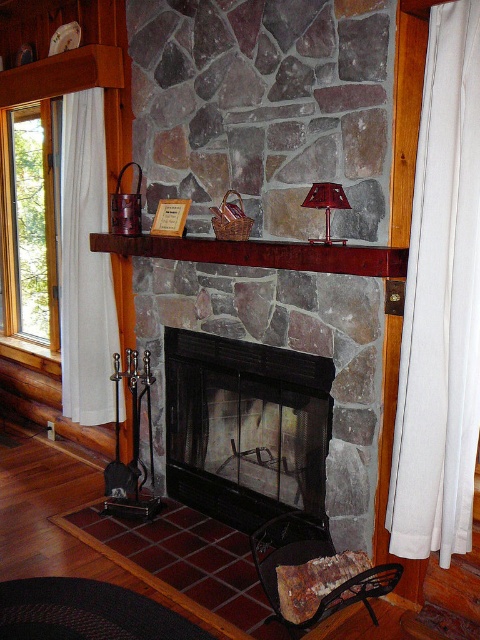
Question: Which of the following is the closest to the observer?

Choices:
 (A) white sheer curtain at right
 (B) white sheer curtain at left

Answer: (A)

Question: Can you confirm if black glass fireplace at center is positioned above shiny red glass lamp at center?

Choices:
 (A) no
 (B) yes

Answer: (A)

Question: Which of the following is the closest to the observer?

Choices:
 (A) (406, 332)
 (B) (396, 273)

Answer: (B)

Question: Which object is farther from the camera taking this photo?

Choices:
 (A) brown wooden mantle at center
 (B) white sheer curtain at left

Answer: (B)

Question: Can you confirm if black glass fireplace at center is bigger than transparent glass window at left?

Choices:
 (A) no
 (B) yes

Answer: (A)

Question: Is white sheer curtain at right wider than black glass fireplace at center?

Choices:
 (A) yes
 (B) no

Answer: (B)